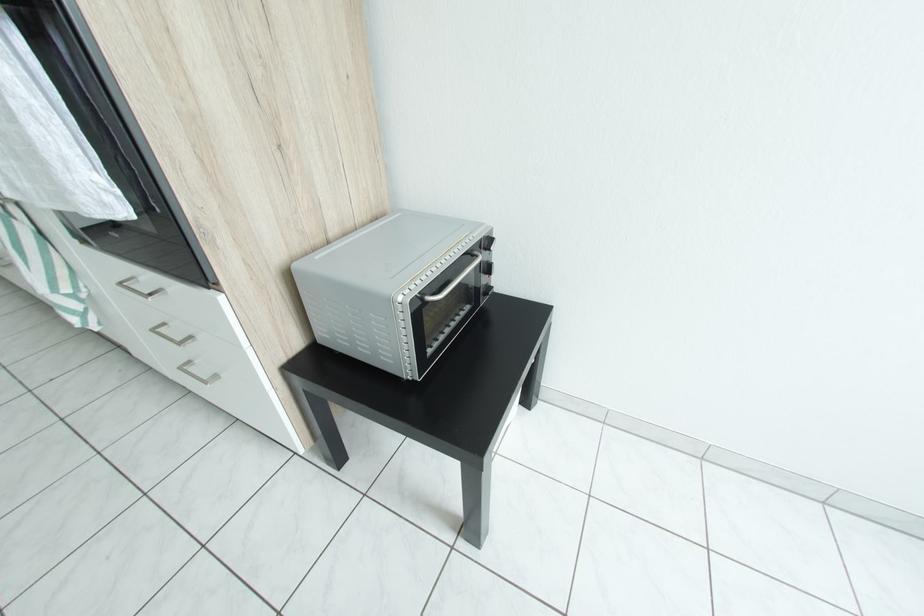
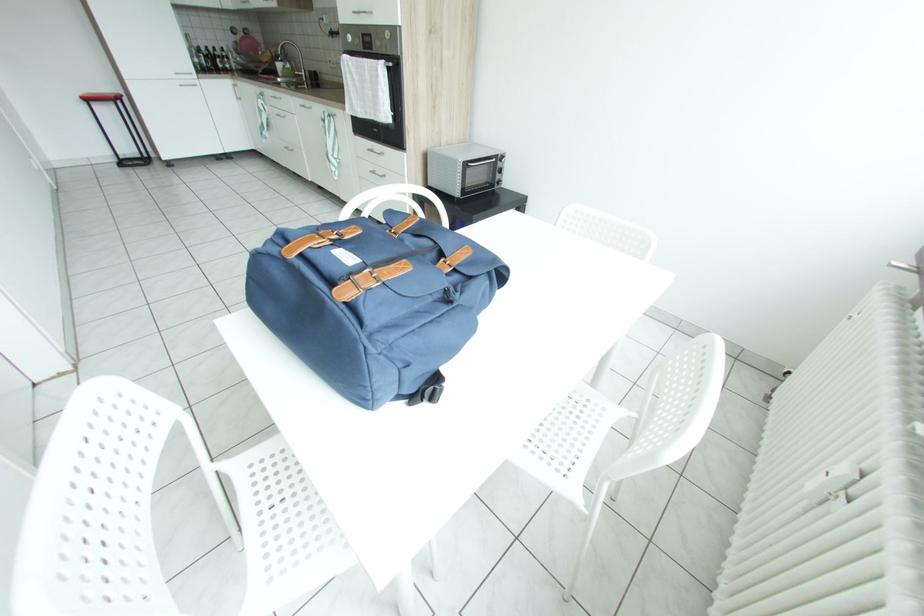
What movement of the cameraman would produce the second image?

The movement direction of the cameraman is right, backward.